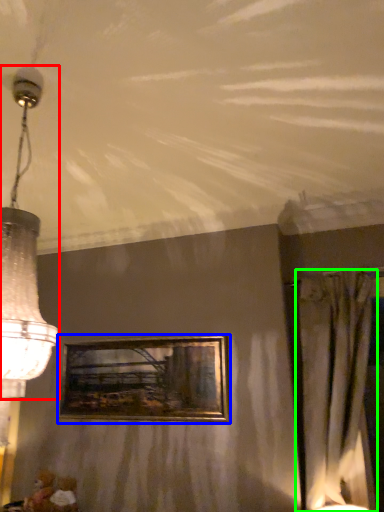
Question: Estimate the real-world distances between objects in this image. Which object is farther from lamp (highlighted by a red box), picture frame (highlighted by a blue box) or curtain (highlighted by a green box)?

Choices:
 (A) picture frame
 (B) curtain

Answer: (B)